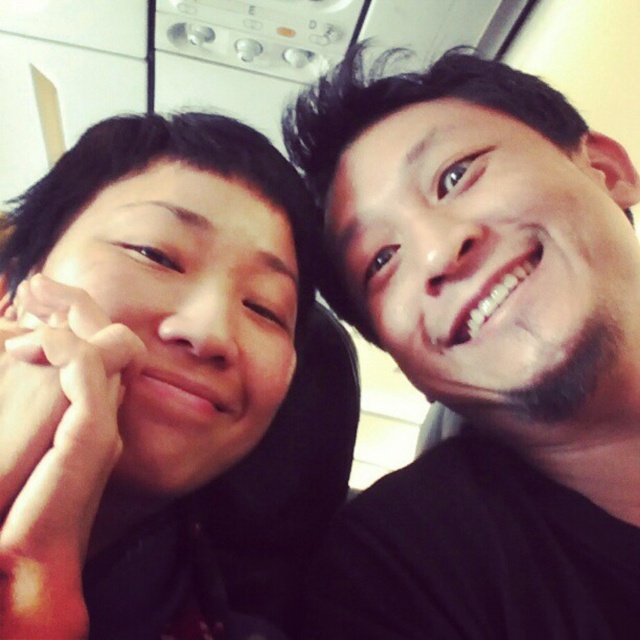
Based on the scene description, where is the smooth skin face at right located in the image?

The smooth skin face at right is located at point (484,252) in the image.

You are taking a photo of two people in a kitchen. The black matte hair at upper right and the matte skin face at left are in the frame. Which object is closer to the camera?

The black matte hair at upper right is positioned over the matte skin face at left, indicating it is closer to the camera.